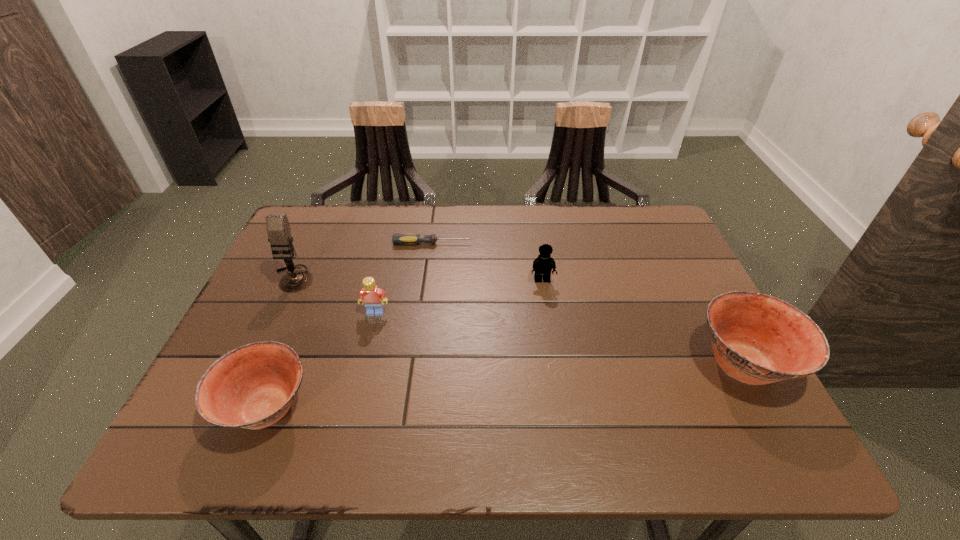
The width and height of the screenshot is (960, 540). Find the location of `object that is at the near left corner`. object that is at the near left corner is located at coordinates (252, 387).

Where is `object that is at the near right corner`? This screenshot has width=960, height=540. object that is at the near right corner is located at coordinates (757, 339).

In the image, there is a desktop. In order to click on free space at the far edge in this screenshot , I will do `click(586, 208)`.

The height and width of the screenshot is (540, 960). I want to click on free point at the right edge, so click(x=683, y=329).

This screenshot has width=960, height=540. Find the location of `free space at the far left corner of the desktop`. free space at the far left corner of the desktop is located at coordinates (301, 220).

Where is `vacant space at the near right corner`? This screenshot has height=540, width=960. vacant space at the near right corner is located at coordinates (684, 408).

Locate an element on the screen. The width and height of the screenshot is (960, 540). vacant space that's between the left bowl and the screwdriver is located at coordinates tap(349, 326).

Where is `unoccupied position between the shortest object and the rightmost object`? Image resolution: width=960 pixels, height=540 pixels. unoccupied position between the shortest object and the rightmost object is located at coordinates (588, 304).

Identify the location of vacant area that lies between the tallest object and the rightmost object. (518, 321).

What are the coordinates of `free space between the rightmost object and the shorter bowl` in the screenshot? It's located at (506, 387).